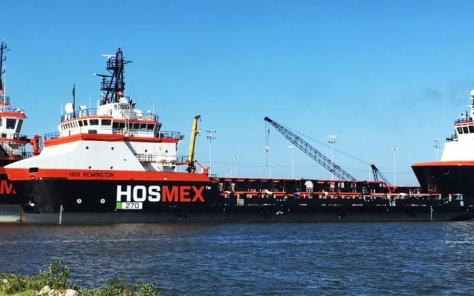
This screenshot has width=474, height=296. I want to click on lights, so click(333, 139), click(396, 149), click(210, 138), click(292, 148), click(437, 147).